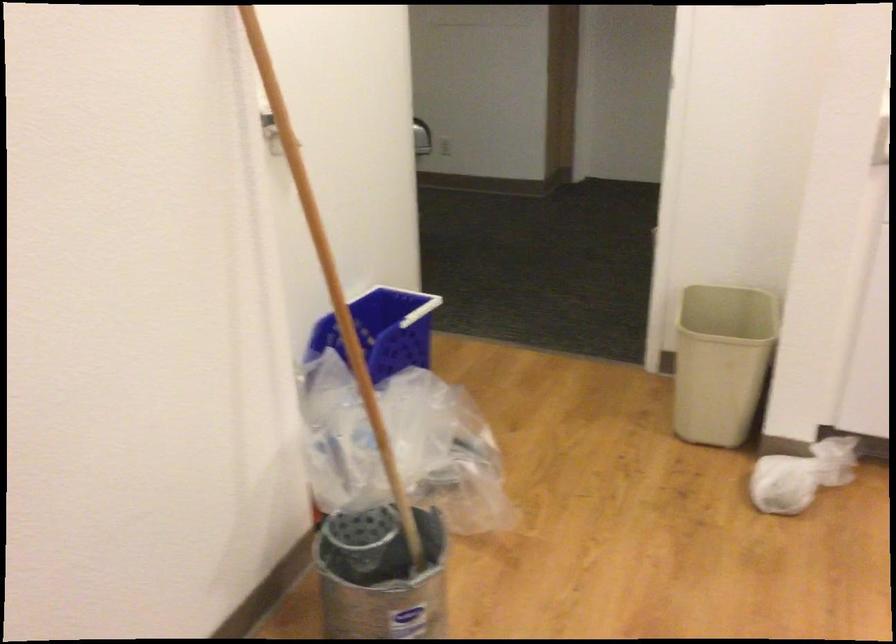
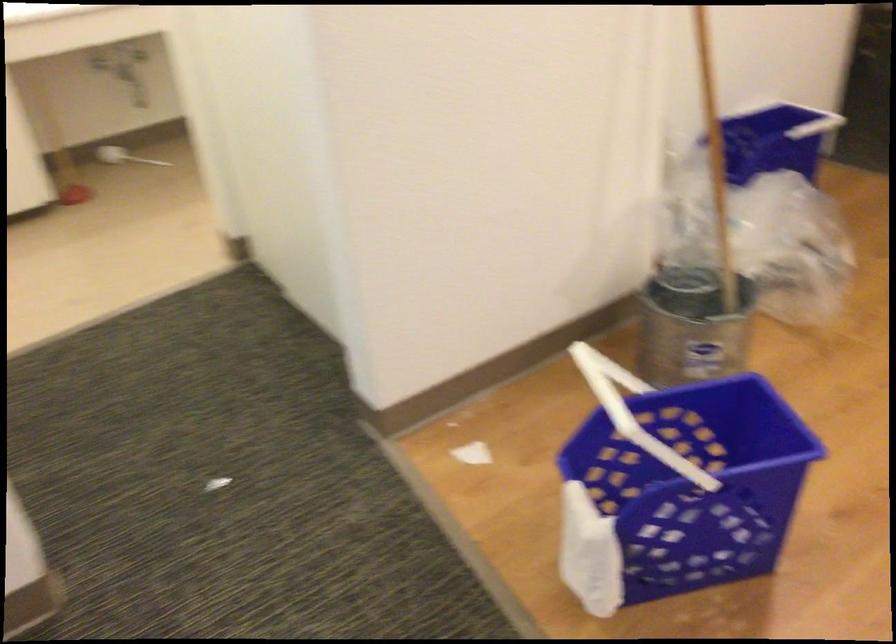
Question: The images are taken continuously from a first-person perspective. In which direction is your viewpoint rotating?

Choices:
 (A) Left
 (B) Right
 (C) Up
 (D) Down

Answer: (A)